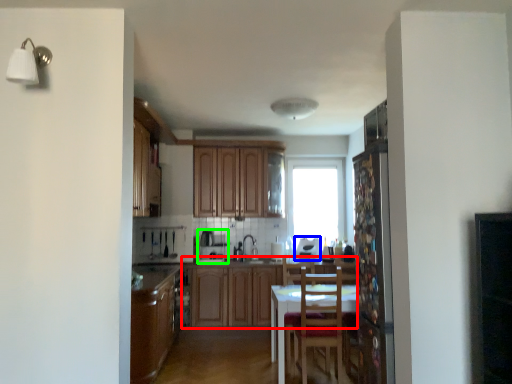
Question: Which is farther away from cabinetry (highlighted by a red box)? appliance (highlighted by a blue box) or appliance (highlighted by a green box)?

Choices:
 (A) appliance
 (B) appliance

Answer: (A)